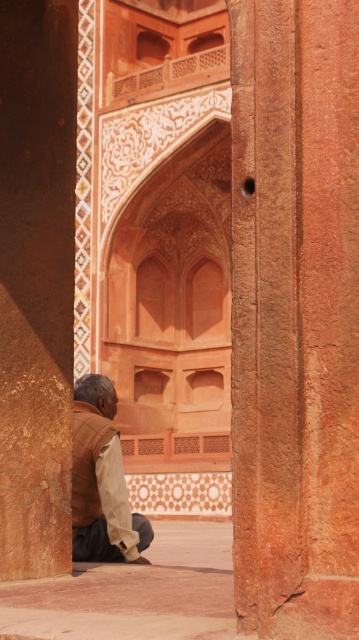
Does rustic stone pillar at center lie behind brown cotton shirt at lower left?

That is False.

Between rustic stone pillar at center and brown cotton shirt at lower left, which one has more height?

Standing taller between the two is brown cotton shirt at lower left.

Who is more forward, (347, 576) or (89, 436)?

Point (347, 576) is in front.

Locate an element on the screen. Image resolution: width=359 pixels, height=640 pixels. rustic stone pillar at center is located at coordinates (295, 316).